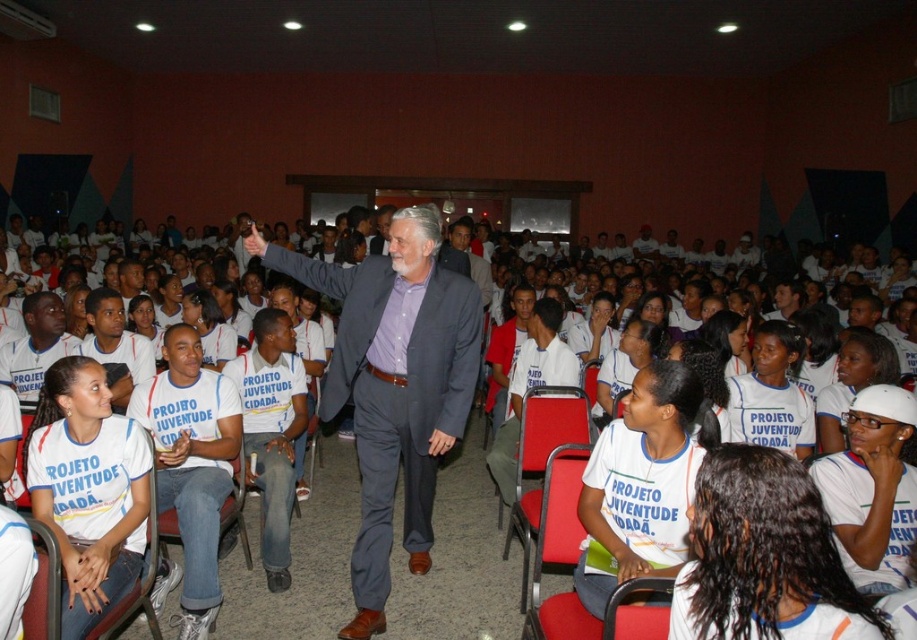
Question: Which point is farther from the camera taking this photo?

Choices:
 (A) (581, 413)
 (B) (381, 394)

Answer: (A)

Question: Considering the real-world distances, which object is closest to the gray suit at center?

Choices:
 (A) red fabric chair at center
 (B) white t-shirt at center
 (C) white cotton shirt at center

Answer: (A)

Question: Considering the real-world distances, which object is closest to the gray suit at center?

Choices:
 (A) red fabric chair at center
 (B) red fabric chair at lower center

Answer: (A)

Question: Does gray suit at center have a larger size compared to white t-shirt at center?

Choices:
 (A) yes
 (B) no

Answer: (A)

Question: Considering the relative positions of gray suit at center and red fabric chair at lower center in the image provided, where is gray suit at center located with respect to red fabric chair at lower center?

Choices:
 (A) left
 (B) right

Answer: (A)

Question: Does white cotton shirt at center have a lesser width compared to red fabric chair at lower center?

Choices:
 (A) no
 (B) yes

Answer: (A)